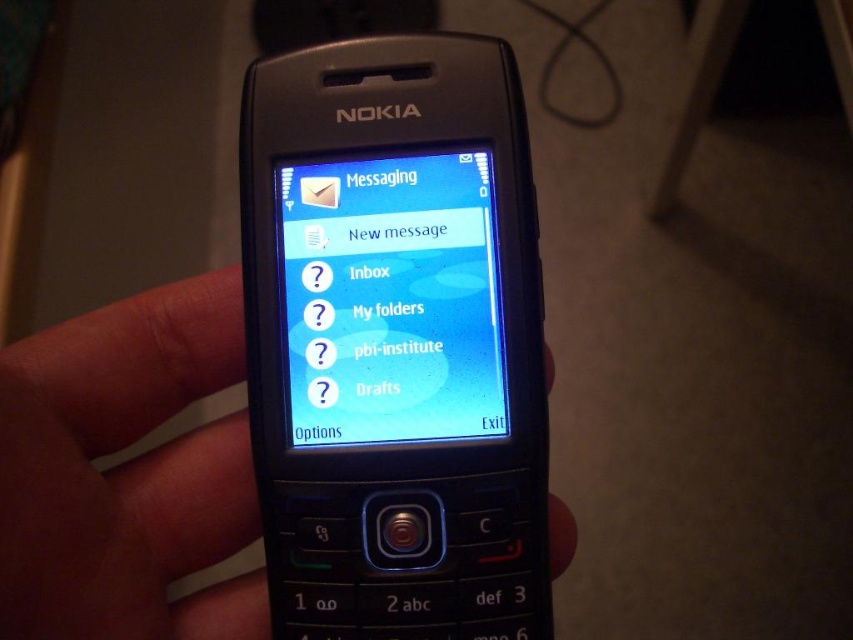
Consider the image. Is black plastic phone at center bigger than black matte phone at center?

Incorrect, black plastic phone at center is not larger than black matte phone at center.

Locate an element on the screen. The image size is (853, 640). black plastic phone at center is located at coordinates (395, 340).

Is point (457, 268) closer to camera compared to point (96, 488)?

No, (457, 268) is behind (96, 488).

Find the location of a particular element. The image size is (853, 640). black plastic phone at center is located at coordinates pos(395,340).

Is the position of black plastic phone at center less distant than that of blue glossy screen at center?

Yes, black plastic phone at center is in front of blue glossy screen at center.

Is point (386, 157) positioned before point (454, 304)?

No, (386, 157) is behind (454, 304).

The image size is (853, 640). I want to click on black plastic phone at center, so click(x=395, y=340).

Which is more to the right, black matte phone at center or blue glossy screen at center?

blue glossy screen at center is more to the right.

The image size is (853, 640). I want to click on black matte phone at center, so click(126, 472).

Is point (125, 618) behind point (451, 314)?

No, it is not.

This screenshot has width=853, height=640. I want to click on black matte phone at center, so click(126, 472).